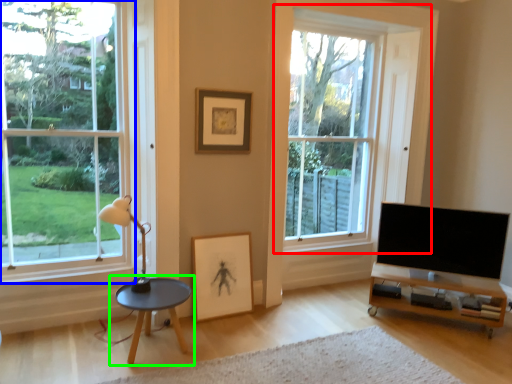
Question: Estimate the real-world distances between objects in this image. Which object is farther from window (highlighted by a red box), window (highlighted by a blue box) or coffee table (highlighted by a green box)?

Choices:
 (A) window
 (B) coffee table

Answer: (B)